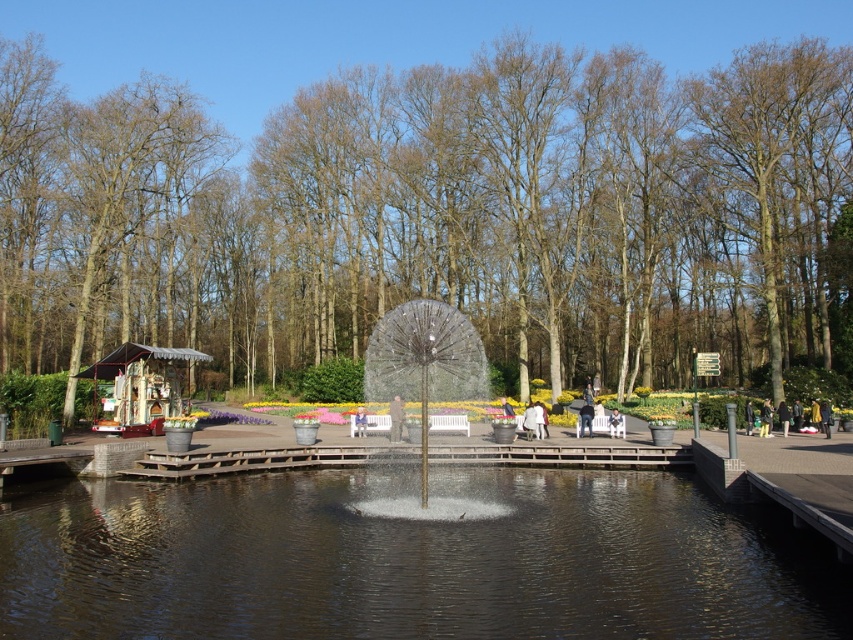
Question: Which object appears farthest from the camera in this image?

Choices:
 (A) light brown wooden bench at center
 (B) brown wood trees at center
 (C) clear glass sphere at center
 (D) light brown leather jacket at lower right

Answer: (A)

Question: Which point is closer to the camera taking this photo?

Choices:
 (A) (627, 305)
 (B) (434, 474)
 (C) (421, 490)
 (D) (761, 406)

Answer: (C)

Question: Does clear glass sphere at center have a lesser width compared to light brown leather jacket at lower right?

Choices:
 (A) yes
 (B) no

Answer: (B)

Question: Does transparent water at center have a greater width compared to brown leather jacket at center?

Choices:
 (A) no
 (B) yes

Answer: (B)

Question: Which of the following is the closest to the observer?

Choices:
 (A) light brown leather jacket at lower right
 (B) white fabric umbrella at center

Answer: (B)

Question: Where is clear glass sphere at center located in relation to white fabric umbrella at center in the image?

Choices:
 (A) above
 (B) below

Answer: (A)